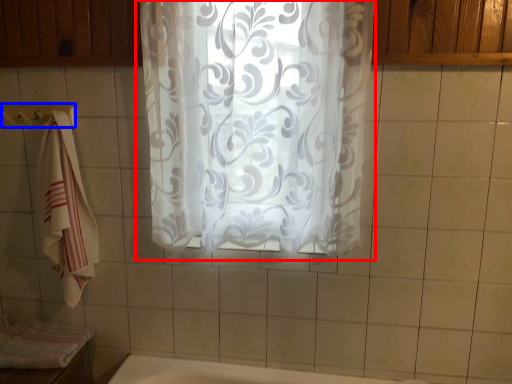
Question: Which object appears closest to the camera in this image, curtain (highlighted by a red box) or towel bar (highlighted by a blue box)?

Choices:
 (A) curtain
 (B) towel bar

Answer: (A)